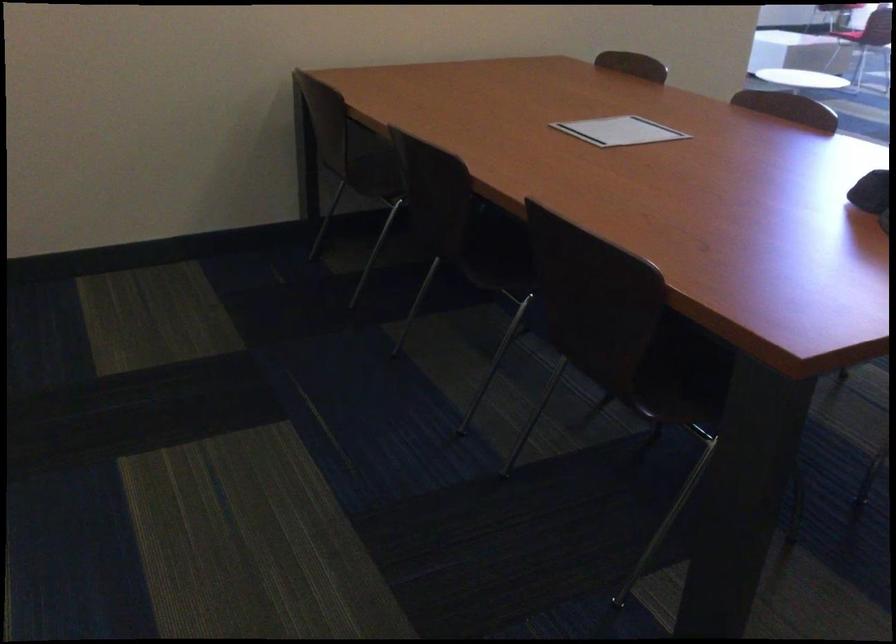
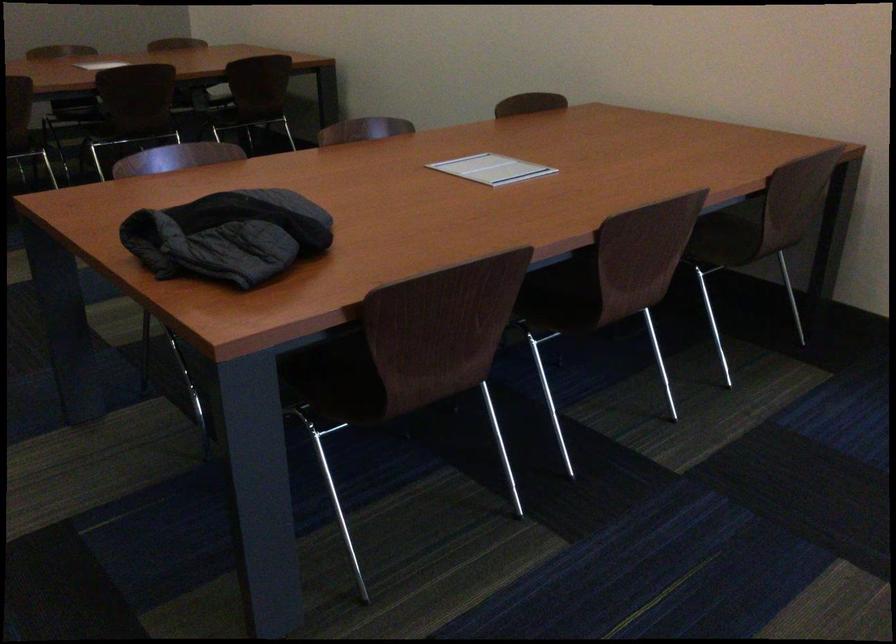
Question: I am providing you with two images of the same scene from different viewpoints. Please identify which objects are invisible in image2.

Choices:
 (A) dark quilted jacket
 (B) brown chair sitting surface
 (C) gold drawer knob
 (D) chair sitting surface

Answer: (B)